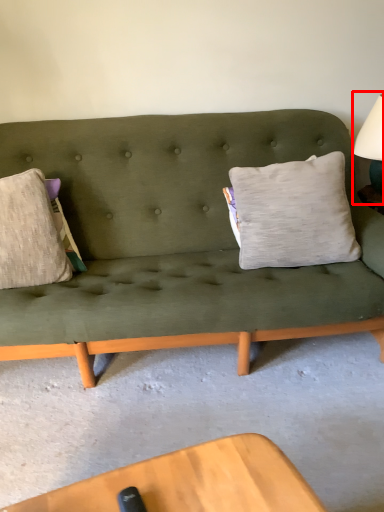
Question: Considering the relative positions of table lamp (annotated by the red box) and pillow in the image provided, where is table lamp (annotated by the red box) located with respect to the staircase?

Choices:
 (A) right
 (B) left

Answer: (A)